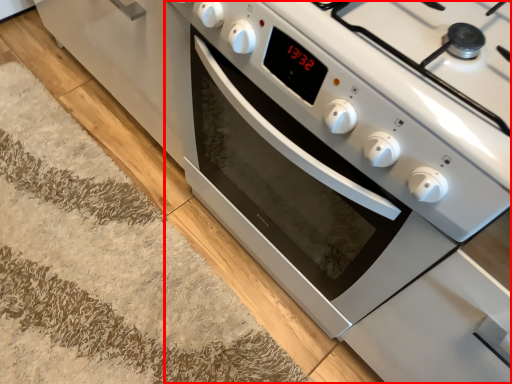
Question: From the image's perspective, what is the correct spatial relationship of oven (annotated by the red box) in relation to doormat?

Choices:
 (A) below
 (B) above

Answer: (B)